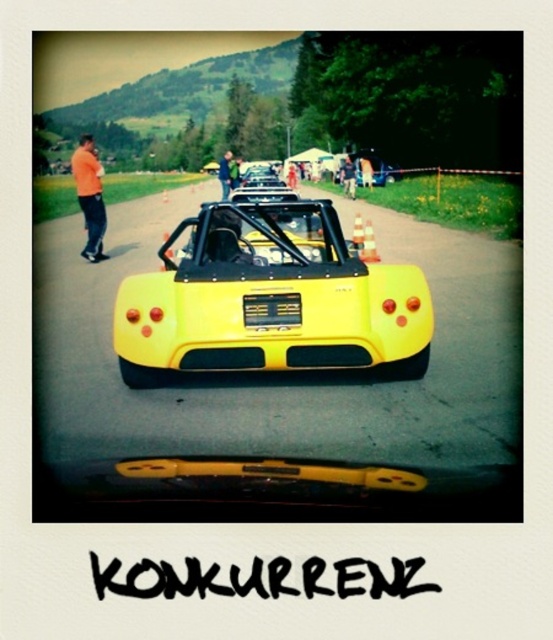
Question: Which object appears farthest from the camera in this image?

Choices:
 (A) yellow matte license plate at center
 (B) denim pants at center
 (C) yellow matte car at center
 (D) yellow matte sports car at center

Answer: (B)

Question: Does orange cotton shirt at left have a larger size compared to light brown leather jacket at center?

Choices:
 (A) yes
 (B) no

Answer: (A)

Question: Is orange cotton shirt at left to the right of blue denim jeans at center from the viewer's perspective?

Choices:
 (A) yes
 (B) no

Answer: (B)

Question: Which object is the farthest from the orange cotton shirt at left?

Choices:
 (A) light brown leather jacket at center
 (B) yellow matte license plate at center

Answer: (A)

Question: Which point is closer to the camera?

Choices:
 (A) denim pants at center
 (B) light brown leather jacket at center
 (C) orange cotton shirt at left
 (D) yellow matte license plate at center

Answer: (D)

Question: Where is yellow matte car at center located in relation to denim pants at center in the image?

Choices:
 (A) above
 (B) below

Answer: (B)